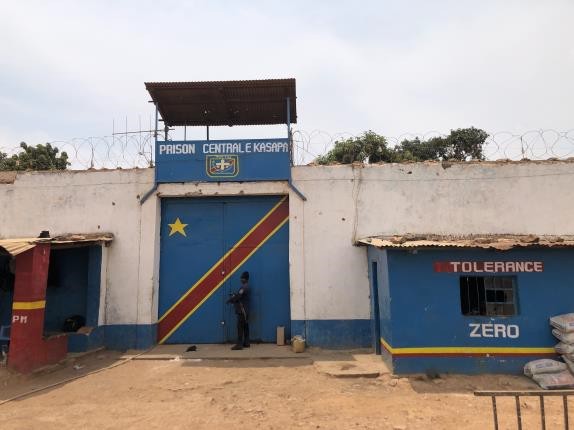
Find the location of a particular element. This screenshot has width=574, height=430. wall is located at coordinates (329, 198).